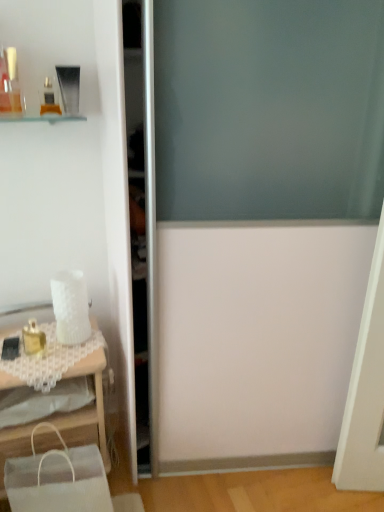
Question: Is white fabric shopping bag at lower left wider or thinner than matte glass perfume bottle at upper left, the first toiletry from the top?

Choices:
 (A) thin
 (B) wide

Answer: (B)

Question: From the image's perspective, is white fabric shopping bag at lower left located above or below matte glass perfume bottle at upper left, the 3th toiletry positioned from the bottom?

Choices:
 (A) below
 (B) above

Answer: (A)

Question: Which object is the closest to the matte glass perfume bottle at upper left, the 3th toiletry positioned from the bottom?

Choices:
 (A) transparent glass screen door at center
 (B) gold metallic perfume at left, which is the first toiletry from bottom to top
 (C) white lace table at lower left
 (D) white fabric shopping bag at lower left
 (E) matte gold compact at upper left, which ranks as the 2th toiletry in bottom-to-top order

Answer: (E)

Question: Estimate the real-world distances between objects in this image. Which object is farther from the matte glass perfume bottle at upper left, the first toiletry from the top?

Choices:
 (A) white lace table at lower left
 (B) white fabric shopping bag at lower left
 (C) matte gold compact at upper left, which ranks as the second toiletry in top-to-bottom order
 (D) gold metallic perfume at left, which is the first toiletry from bottom to top
 (E) transparent glass screen door at center

Answer: (B)